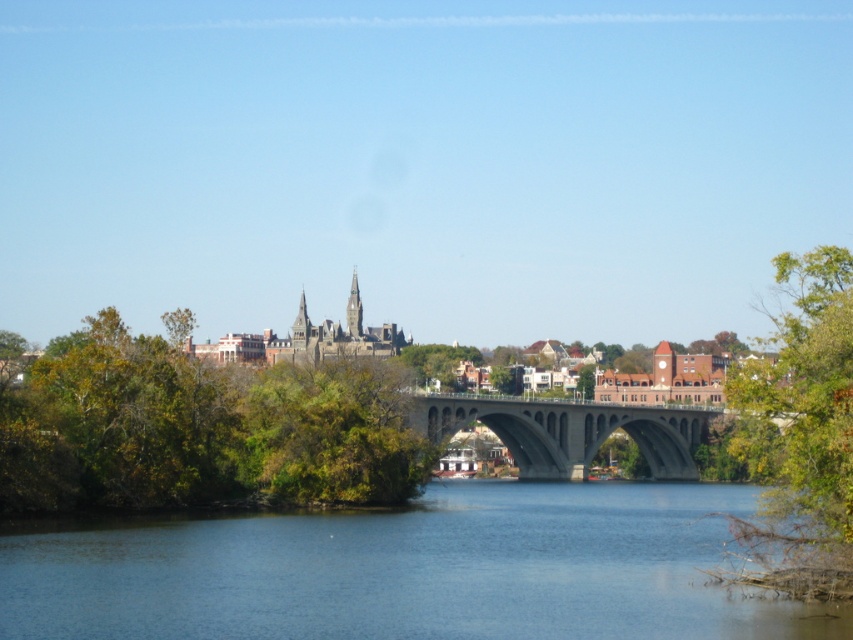
You are standing at the point marked by the coordinate point (199, 428) in the riverside scene. Which object from the scene is located at this exact coordinate?

The green leafy trees at left are located at the coordinate point (199, 428).

You are a bird soaring above the riverside scene. You want to land on the tallest object between the green leafy trees at left and the gray stone spire at center. Which one should you choose?

The green leafy trees at left are taller than the gray stone spire at center, so you should land on the green leafy trees at left.